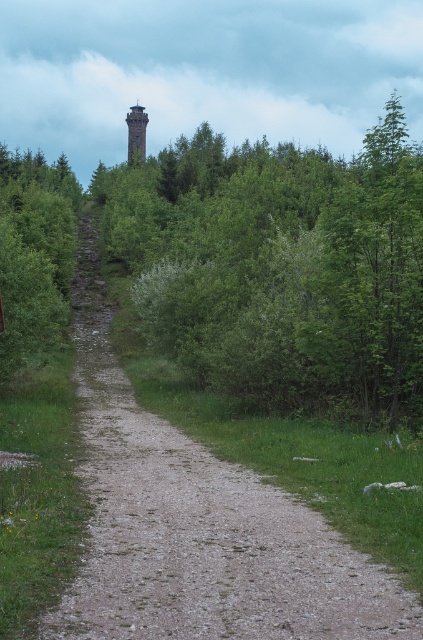
Is point (159, 232) in front of point (112, 582)?

No, it is behind (112, 582).

Between point (343, 220) and point (129, 616), which one is positioned in front?

Point (129, 616)

This screenshot has height=640, width=423. In order to click on green leafy forest at upper center in this screenshot , I will do `click(277, 268)`.

Who is more forward, (348, 577) or (148, 118)?

Positioned in front is point (348, 577).

The image size is (423, 640). In order to click on dirt/gravel path at center in this screenshot , I will do `click(198, 525)`.

Between point (228, 342) and point (129, 132), which one is positioned in front?

Point (228, 342) is more forward.

Who is taller, green leafy forest at upper center or smooth stone tower at upper center?

Standing taller between the two is green leafy forest at upper center.

The height and width of the screenshot is (640, 423). What are the coordinates of `green leafy forest at upper center` in the screenshot? It's located at (277, 268).